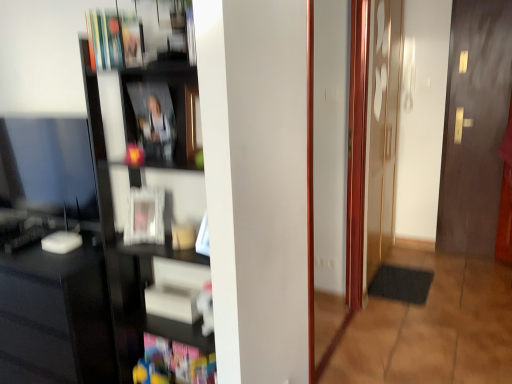
Question: In the image, is hardcover book at upper left, positioned as the second book in top-to-bottom order, on the left side or the right side of dark wood door at right?

Choices:
 (A) right
 (B) left

Answer: (B)

Question: In terms of size, does hardcover book at upper left, the sixth book when ordered from bottom to top, appear bigger or smaller than dark wood door at right?

Choices:
 (A) small
 (B) big

Answer: (A)

Question: Which object is positioned closest to the black glossy computer desk at left?

Choices:
 (A) matte black book at center, which is the fourth book in top-to-bottom order
 (B) black rubber mat at lower right
 (C) hardcover book at upper left, the sixth book when ordered from bottom to top
 (D) black glossy shelf at left
 (E) multicolored cardboard book at lower center, acting as the first book starting from the bottom

Answer: (D)

Question: Which of these objects is positioned closest to the hardcover book at upper center, which is the third book in top-to-bottom order?

Choices:
 (A) multicolored cardboard book at lower center, arranged as the seventh book when viewed from the top
 (B) hardcover book at upper left, the seventh book positioned from the bottom
 (C) matte black book at center, which is the fourth book in top-to-bottom order
 (D) black glossy computer desk at left
 (E) white matte book at center, which appears as the 6th book when viewed from the top

Answer: (B)